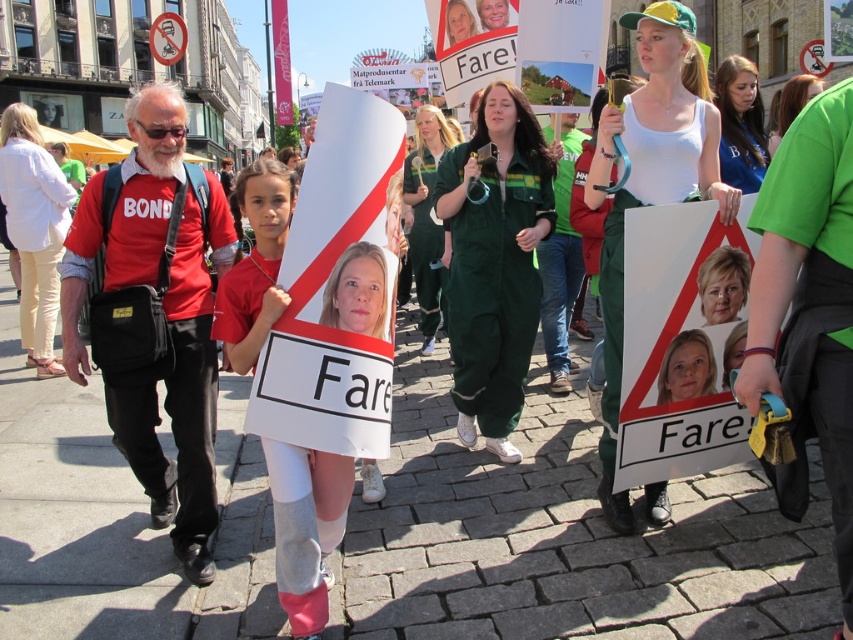
Is matte blue shirt at center positioned before smooth white face at center?

No, matte blue shirt at center is further to the viewer.

Can you confirm if matte blue shirt at center is smaller than smooth white face at center?

No, matte blue shirt at center is not smaller than smooth white face at center.

Between point (723, 74) and point (662, 400), which one is positioned in front?

Point (662, 400)

Locate an element on the screen. matte blue shirt at center is located at coordinates (740, 124).

Can you confirm if white fabric sign at center is positioned to the right of green uniform at center?

Incorrect, white fabric sign at center is not on the right side of green uniform at center.

Who is positioned more to the right, white fabric sign at center or green uniform at center?

green uniform at center

Is point (347, 310) in front of point (425, 202)?

Yes, point (347, 310) is closer to viewer.

Locate an element on the screen. This screenshot has height=640, width=853. white fabric sign at center is located at coordinates (306, 528).

Can you confirm if white cotton pants at left is positioned below matte blue shirt at center?

Yes, white cotton pants at left is below matte blue shirt at center.

Between white cotton pants at left and matte blue shirt at center, which one appears on the left side from the viewer's perspective?

Positioned to the left is white cotton pants at left.

Image resolution: width=853 pixels, height=640 pixels. What are the coordinates of `white cotton pants at left` in the screenshot? It's located at pos(33,228).

Where is `white cotton pants at left`? Image resolution: width=853 pixels, height=640 pixels. white cotton pants at left is located at coordinates (33, 228).